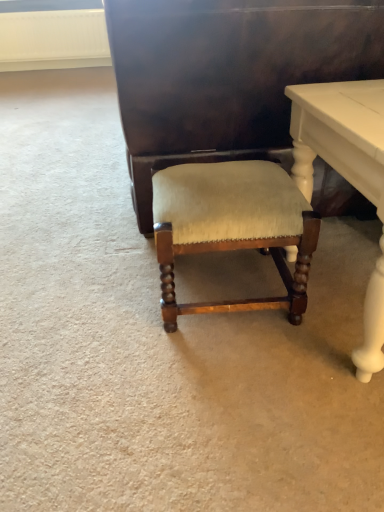
What are the coordinates of `free area in between suede-like beige cushion at center and white glossy table at lower right` in the screenshot? It's located at (267, 350).